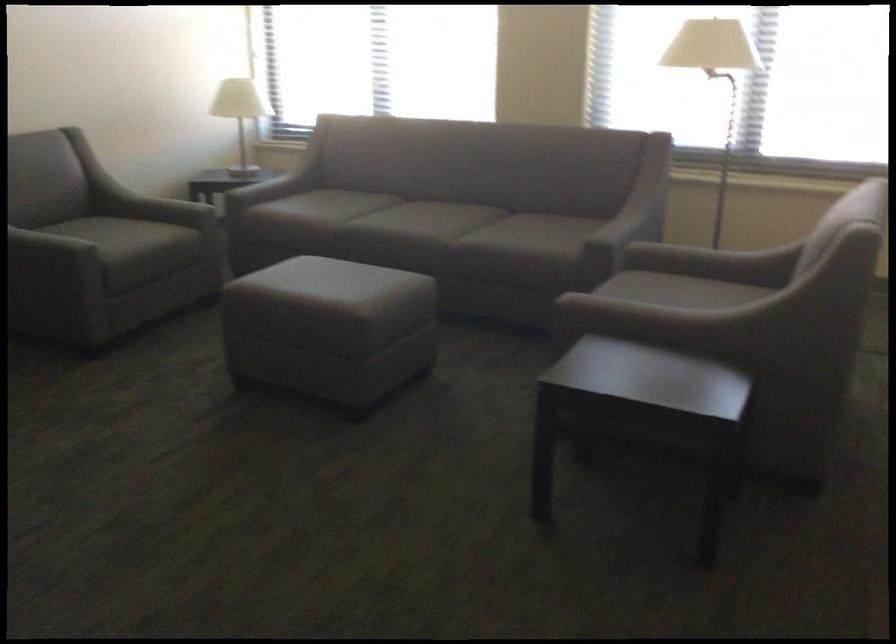
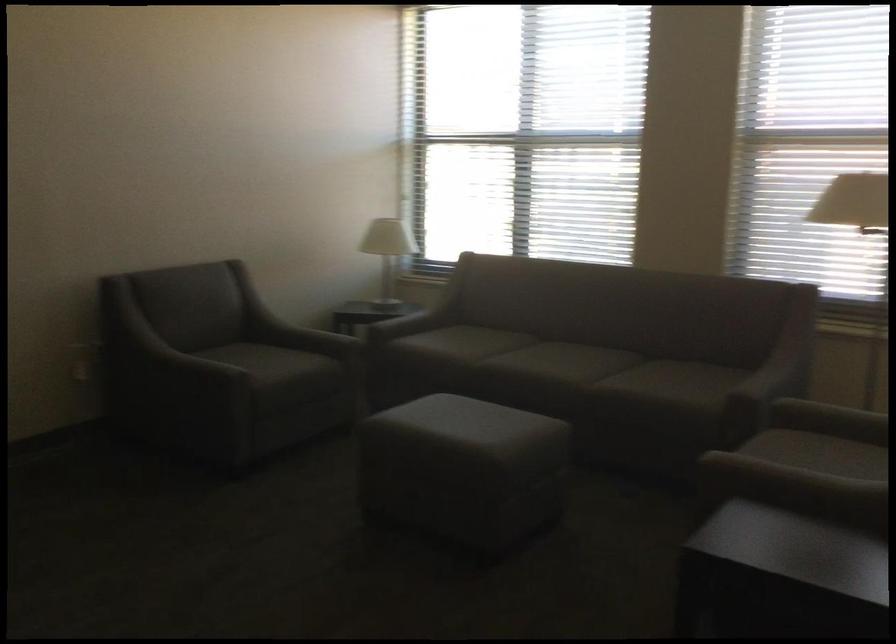
Find the pixel in the second image that matches pixel 245 117 in the first image.

(386, 252)